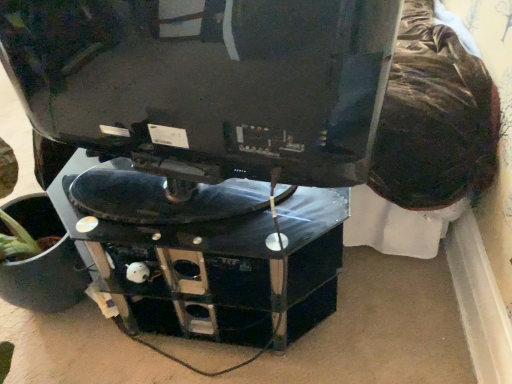
Where is `blank space above black glossy computer desk at center (from a real-world perspective)`? Image resolution: width=512 pixels, height=384 pixels. blank space above black glossy computer desk at center (from a real-world perspective) is located at coordinates (205, 217).